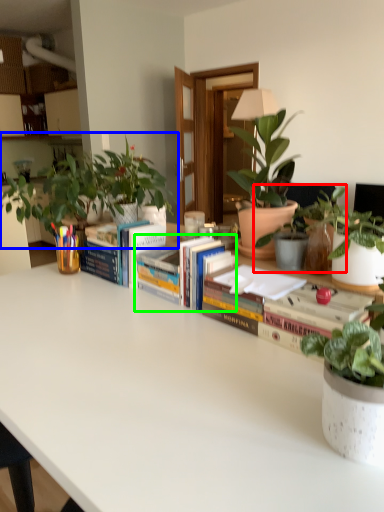
Question: Which is nearer to the houseplant (highlighted by a red box)? houseplant (highlighted by a blue box) or book (highlighted by a green box).

Choices:
 (A) houseplant
 (B) book

Answer: (B)